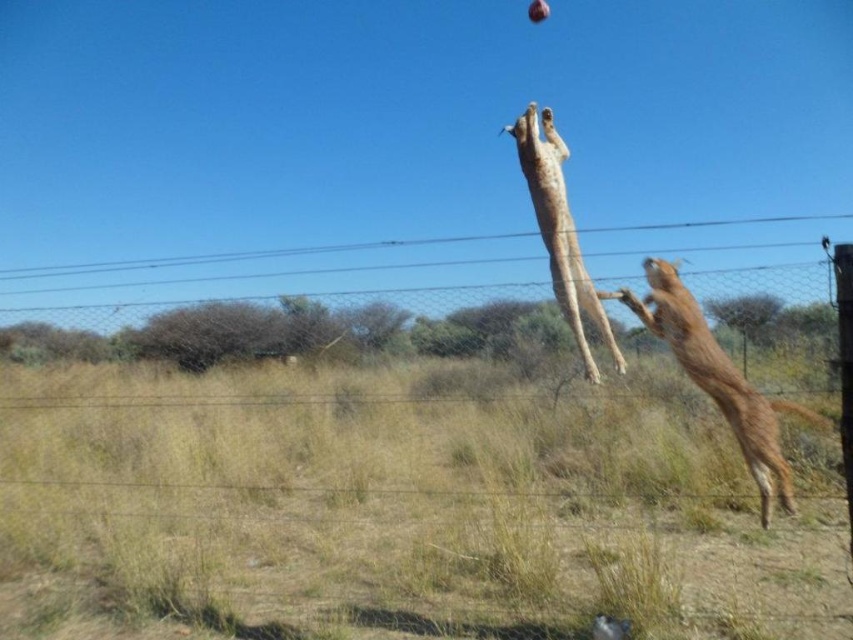
Question: Can you confirm if wire mesh fence at center is positioned to the left of brown furry dog at upper right?

Choices:
 (A) no
 (B) yes

Answer: (B)

Question: Among these points, which one is nearest to the camera?

Choices:
 (A) (715, 307)
 (B) (718, 372)
 (C) (521, 163)
 (D) (828, 476)

Answer: (A)

Question: Which point is farther to the camera?

Choices:
 (A) golden fur dog at center
 (B) brown furry dog at upper right
 (C) wire mesh fence at center

Answer: (A)

Question: Which is nearer to the wire mesh fence at center?

Choices:
 (A) golden fur dog at center
 (B) brown furry dog at upper right

Answer: (B)

Question: Where is brown furry dog at upper right located in relation to golden fur dog at center in the image?

Choices:
 (A) below
 (B) above

Answer: (A)

Question: Is brown furry dog at upper right further to the viewer compared to golden fur dog at center?

Choices:
 (A) no
 (B) yes

Answer: (A)